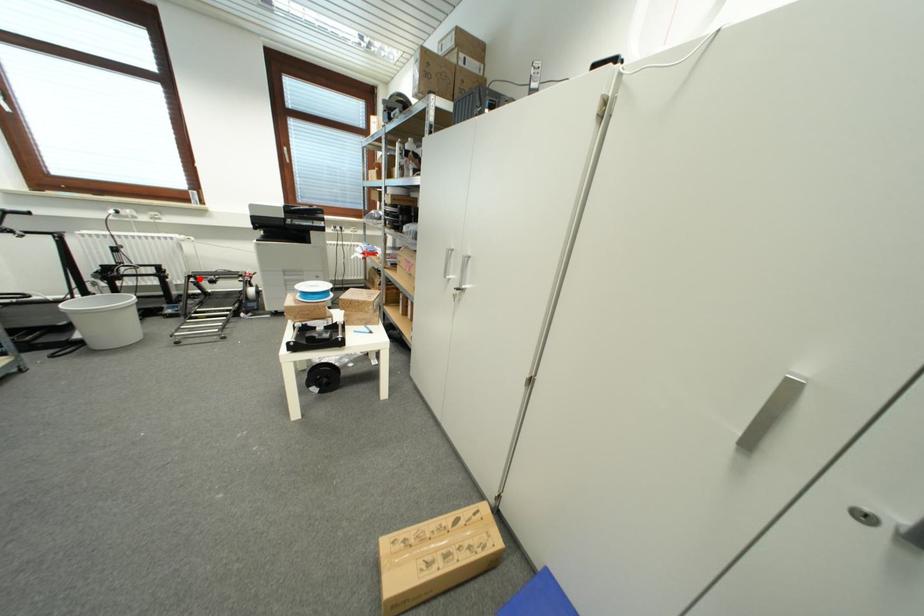
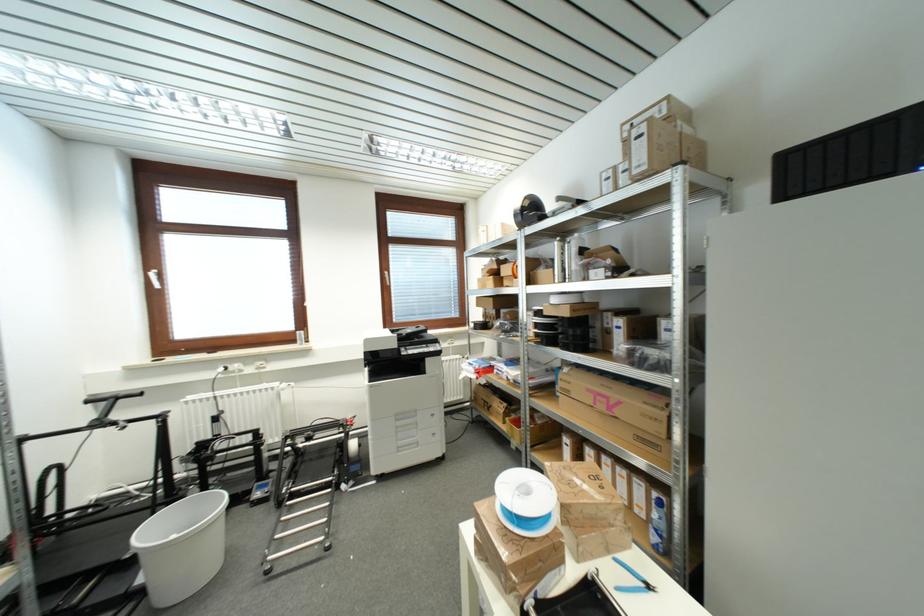
Question: I am providing you with two images of the same scene from different viewpoints. In image1, a red point is highlighted. Considering the same 3D point in image2, which of the following is correct?

Choices:
 (A) It is closer
 (B) It is farther

Answer: (B)